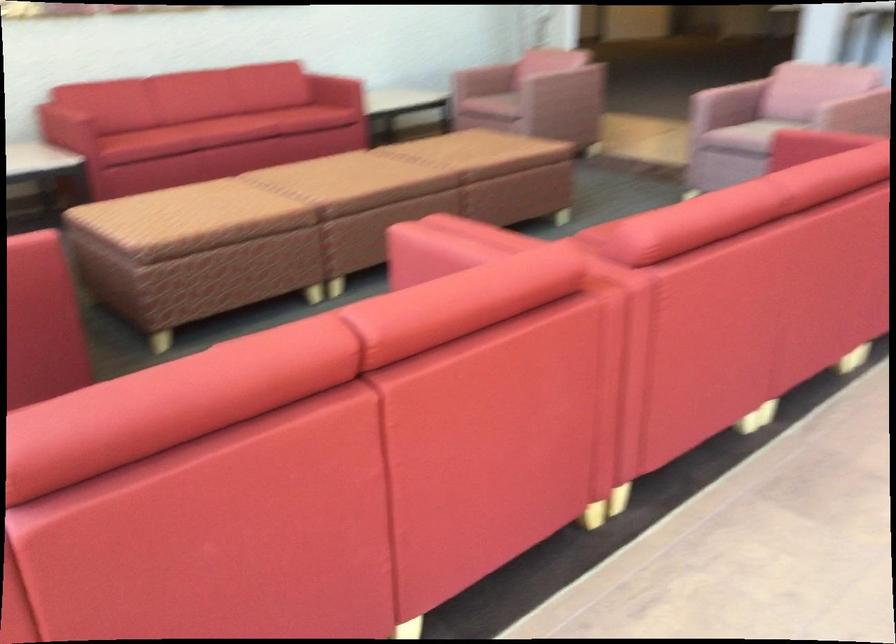
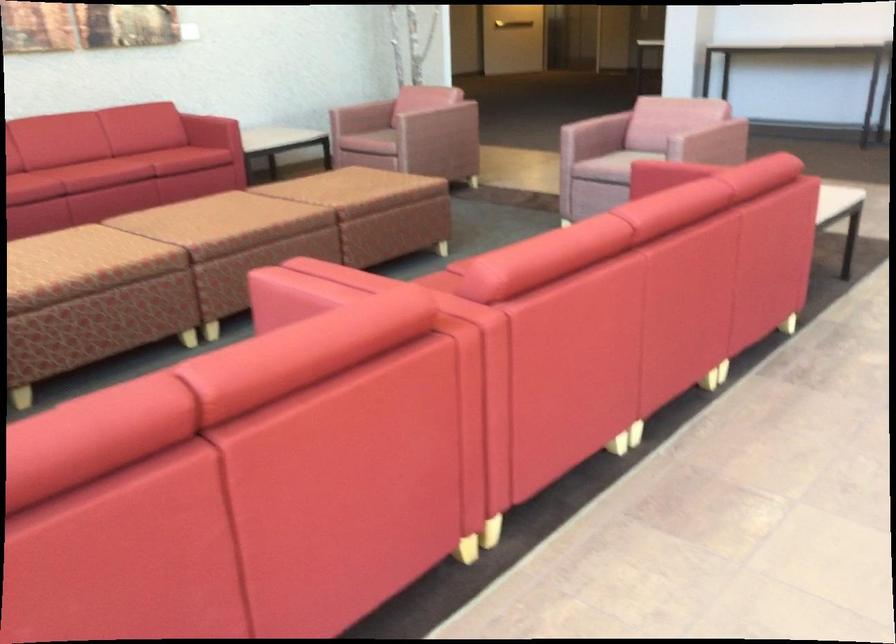
Question: I am providing you with two images of the same scene from different viewpoints. After the viewpoint changes to image2, which objects are now occluded?

Choices:
 (A) red sofa armrest
 (B) patterned brown ottoman
 (C) red sofa sitting surface
 (D) none of these

Answer: (D)